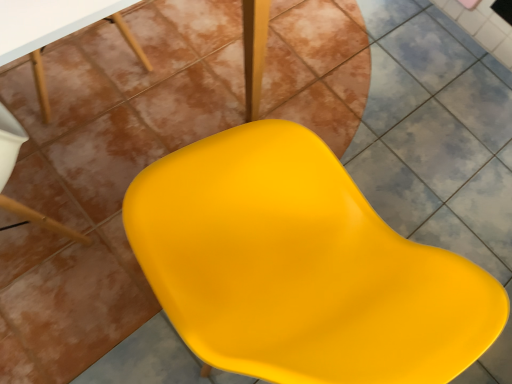
Describe the element at coordinates (300, 267) in the screenshot. I see `glossy plastic chair at center` at that location.

Image resolution: width=512 pixels, height=384 pixels. I want to click on glossy plastic chair at center, so click(x=300, y=267).

The image size is (512, 384). I want to click on glossy plastic chair at center, so click(x=300, y=267).